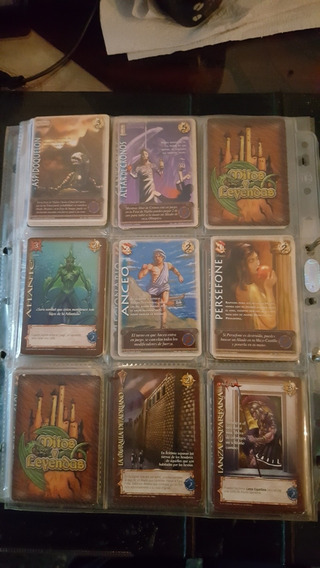
Identify the location of playing cards. (80, 179), (149, 176), (243, 169), (270, 285), (163, 278), (60, 267), (58, 400), (146, 411), (250, 417).